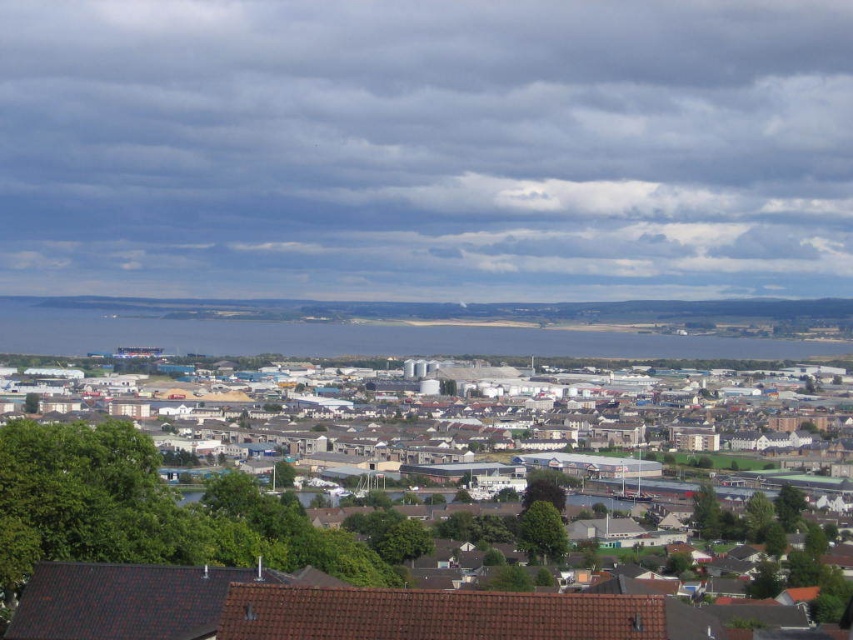
How far apart are industrial buildings at center and blue water at center?

industrial buildings at center is 64.30 feet from blue water at center.

Is point (751, 387) positioned after point (602, 348)?

Yes, it is behind point (602, 348).

Does point (281, 458) come farther from viewer compared to point (86, 352)?

No, (281, 458) is in front of (86, 352).

Image resolution: width=853 pixels, height=640 pixels. Identify the location of industrial buildings at center. (483, 417).